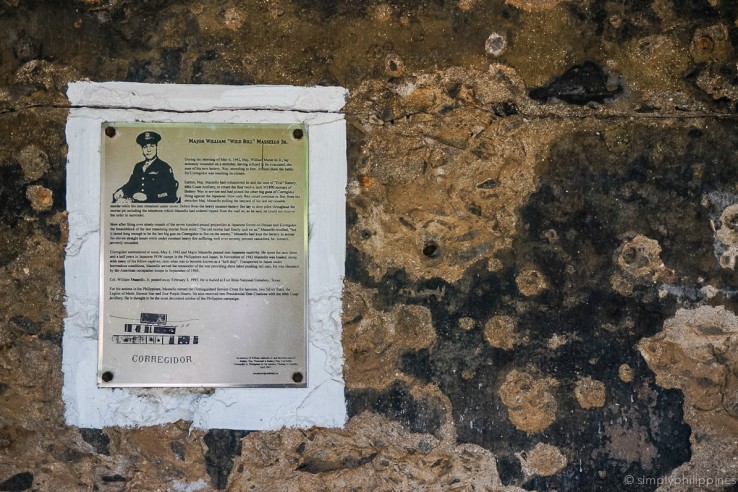
I want to click on wall, so click(502, 220).